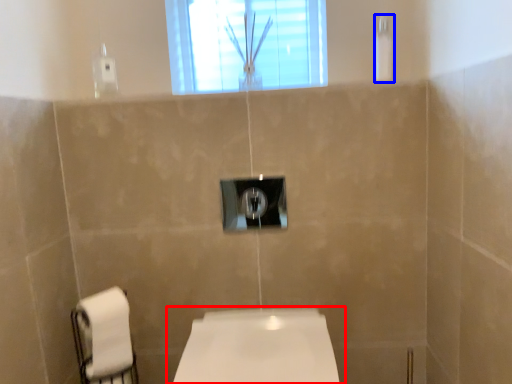
Question: Which of the following is the farthest to the observer, toilet (highlighted by a red box) or shower (highlighted by a blue box)?

Choices:
 (A) toilet
 (B) shower

Answer: (B)